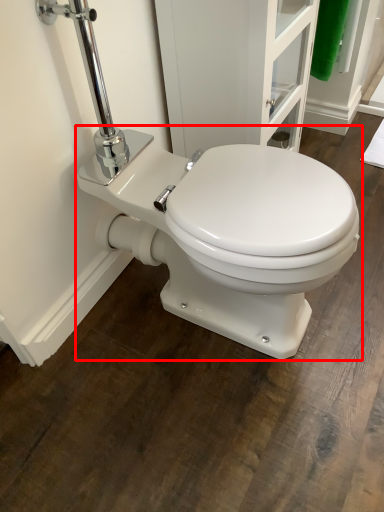
Question: From the image's perspective, what is the correct spatial positioning of toilet (annotated by the red box) in reference to screen door?

Choices:
 (A) below
 (B) above

Answer: (A)